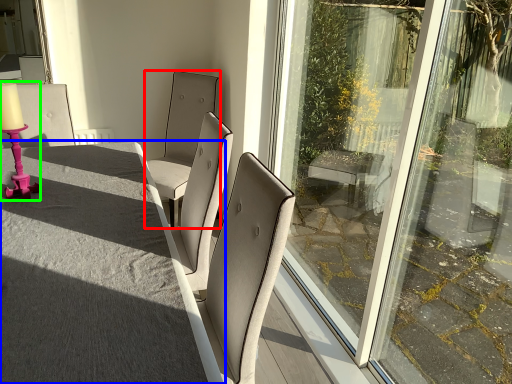
Question: Which object is positioned farthest from chair (highlighted by a red box)? Select from table (highlighted by a blue box) and candle holder (highlighted by a green box).

Choices:
 (A) table
 (B) candle holder

Answer: (A)